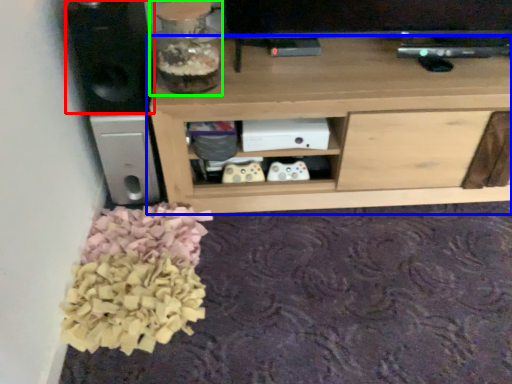
Question: Estimate the real-world distances between objects in this image. Which object is farther from speaker (highlighted by a red box), shelf (highlighted by a blue box) or glass vase (highlighted by a green box)?

Choices:
 (A) shelf
 (B) glass vase

Answer: (A)